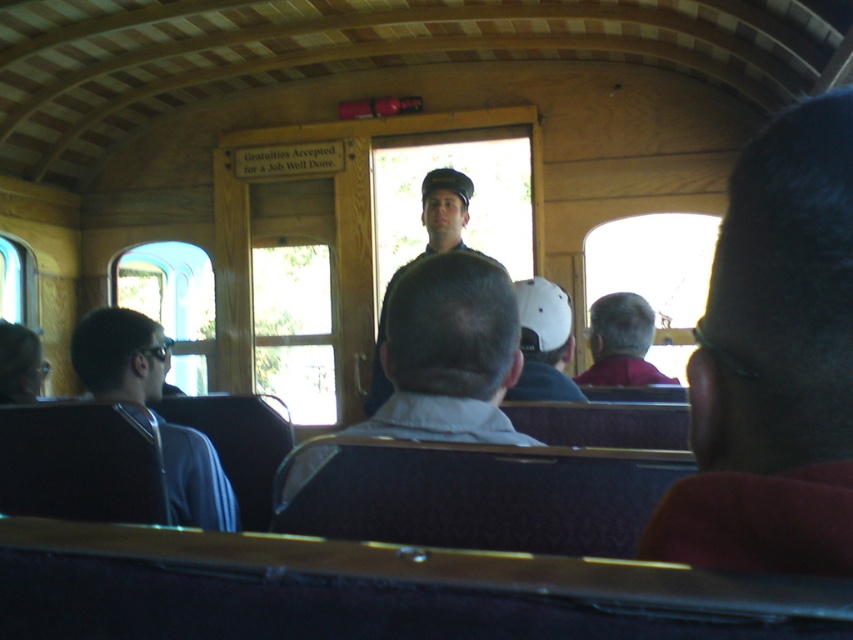
Who is positioned more to the left, dark brown hair at upper right or uniformed man at center?

From the viewer's perspective, uniformed man at center appears more on the left side.

Based on the photo, between dark brown hair at upper right and uniformed man at center, which one is positioned lower?

uniformed man at center

Consider the image. Who is more distant from viewer, (851, 212) or (384, 292)?

Point (384, 292)

You are a GUI agent. You are given a task and a screenshot of the screen. Output one action in this format:
    pyautogui.click(x=<x>, y=<y>)
    Task: Click on the dark brown hair at upper right
    
    Given the screenshot: What is the action you would take?
    pyautogui.click(x=775, y=364)

Is point (786, 113) positioned before point (215, 470)?

Yes, point (786, 113) is in front of point (215, 470).

Is dark brown hair at upper right bigger than blue fabric jacket at left?

No.

Is point (793, 406) farther from camera compared to point (155, 333)?

No, (793, 406) is closer to viewer.

Locate an element on the screen. The height and width of the screenshot is (640, 853). dark brown hair at upper right is located at coordinates (775, 364).

Is point (149, 381) positioned before point (622, 358)?

Yes, point (149, 381) is closer to viewer.

I want to click on blue fabric jacket at left, so click(119, 355).

Locate an element on the screen. The height and width of the screenshot is (640, 853). blue fabric jacket at left is located at coordinates (119, 355).